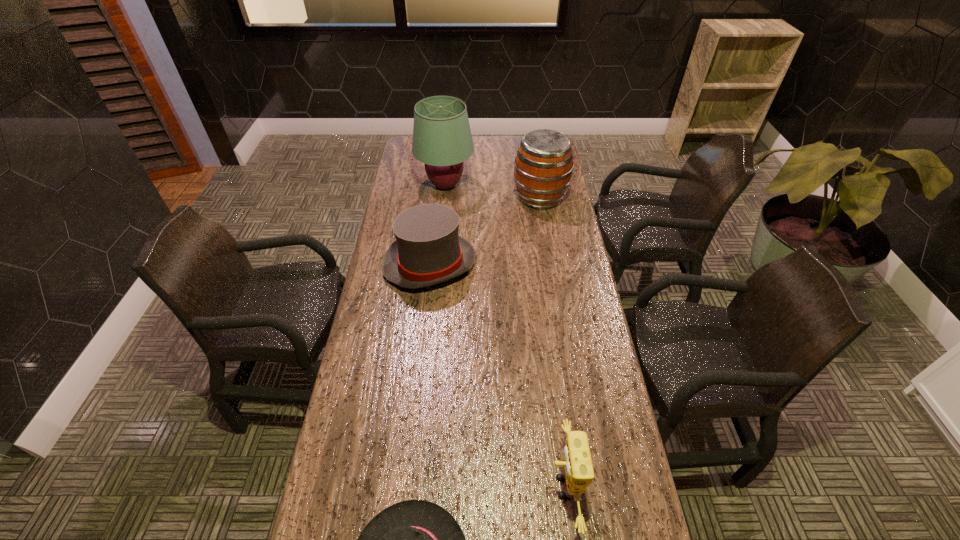
Where is `the tallest object`? Image resolution: width=960 pixels, height=540 pixels. the tallest object is located at coordinates (442, 139).

In order to click on cider in this screenshot , I will do `click(543, 166)`.

Locate an element on the screen. the farther dress hat is located at coordinates (428, 250).

Identify the location of the third farthest object. (428, 250).

In order to click on vacant region located on the right of the tallest object in this screenshot , I will do `click(529, 185)`.

Where is `free region located on the left of the cider`? This screenshot has height=540, width=960. free region located on the left of the cider is located at coordinates (430, 197).

Where is `blank space located on the front of the farther dress hat`? blank space located on the front of the farther dress hat is located at coordinates (416, 394).

The width and height of the screenshot is (960, 540). Find the location of `lampshade that is positioned at the left edge`. lampshade that is positioned at the left edge is located at coordinates (442, 139).

Identify the location of dress hat present at the left edge. The width and height of the screenshot is (960, 540). [x=428, y=250].

What are the coordinates of `object at the right edge` in the screenshot? It's located at (543, 166).